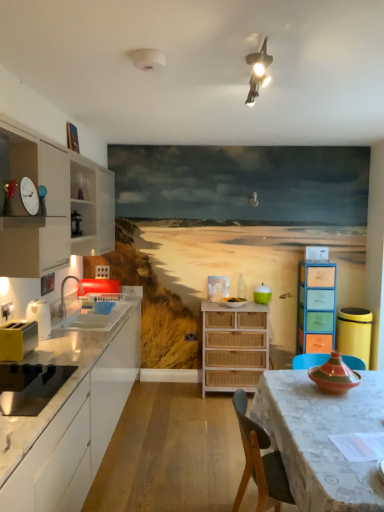
The height and width of the screenshot is (512, 384). What do you see at coordinates (94, 311) in the screenshot? I see `white glossy sink at left` at bounding box center [94, 311].

Image resolution: width=384 pixels, height=512 pixels. I want to click on green matte jar at center, the first appliance in the back-to-front sequence, so click(262, 294).

Consider the image. How much space does black matte toaster at left, the 2th appliance when ordered from bottom to top, occupy horizontally?

black matte toaster at left, the 2th appliance when ordered from bottom to top, is 16.86 inches wide.

From the picture: Measure the distance between white glossy countertop at left, which ranks as the second cabinetry in top-to-bottom order, and camera.

white glossy countertop at left, which ranks as the second cabinetry in top-to-bottom order, and camera are 4.62 feet apart from each other.

Where is `yellow plastic toaster at left`? This screenshot has height=512, width=384. yellow plastic toaster at left is located at coordinates (17, 340).

Is green matte jar at center, the first appliance in the back-to-front sequence, located within woven wood chest of drawers at center, acting as the second chest of drawers starting from the right?

Actually, green matte jar at center, the first appliance in the back-to-front sequence, is outside woven wood chest of drawers at center, acting as the second chest of drawers starting from the right.

In the scene shown: Considering the positions of objects woven wood chest of drawers at center, acting as the second chest of drawers starting from the right, and green matte jar at center, acting as the second appliance starting from the top, in the image provided, who is more to the left, woven wood chest of drawers at center, acting as the second chest of drawers starting from the right, or green matte jar at center, acting as the second appliance starting from the top,?

Positioned to the left is woven wood chest of drawers at center, acting as the second chest of drawers starting from the right.

Where is `the 2nd chest of drawers below the green matte jar at center, which appears as the 6th appliance when ordered from the bottom (from the image's perspective)`? The image size is (384, 512). the 2nd chest of drawers below the green matte jar at center, which appears as the 6th appliance when ordered from the bottom (from the image's perspective) is located at coordinates (233, 346).

Considering the positions of objects white glossy countertop at left, which ranks as the second cabinetry in top-to-bottom order, and black matte toaster at left, placed as the 7th appliance when sorted from back to front, in the image provided, who is more to the right, white glossy countertop at left, which ranks as the second cabinetry in top-to-bottom order, or black matte toaster at left, placed as the 7th appliance when sorted from back to front,?

black matte toaster at left, placed as the 7th appliance when sorted from back to front, is more to the right.

Identify the location of appliance that is the 1st object located behind the white glossy countertop at left, which ranks as the second cabinetry in top-to-bottom order. (30, 387).

From a real-world perspective, which is physically below, white glossy countertop at left, the 1th cabinetry positioned from the bottom, or black matte toaster at left, placed as the 7th appliance when sorted from back to front?

white glossy countertop at left, the 1th cabinetry positioned from the bottom, from a real-world perspective.

Could you measure the distance between white glossy countertop at left, the 1th cabinetry positioned from the bottom, and black matte toaster at left, placed as the 7th appliance when sorted from back to front?

A distance of 14.46 inches exists between white glossy countertop at left, the 1th cabinetry positioned from the bottom, and black matte toaster at left, placed as the 7th appliance when sorted from back to front.

Which object is more forward, white glossy toaster at left, arranged as the 5th appliance when ordered from the bottom, or matte wooden drawer at center, positioned as the sixth appliance in front-to-back order?

white glossy toaster at left, arranged as the 5th appliance when ordered from the bottom, is closer to the camera.

Is white glossy toaster at left, which is the seventh appliance in right-to-left order, not close to matte wooden drawer at center, the 4th appliance viewed from the left?

white glossy toaster at left, which is the seventh appliance in right-to-left order, is far away from matte wooden drawer at center, the 4th appliance viewed from the left.

In terms of width, does white glossy toaster at left, arranged as the first appliance when viewed from the left, look wider or thinner when compared to matte wooden drawer at center, positioned as the 4th appliance in top-to-bottom order?

Clearly, white glossy toaster at left, arranged as the first appliance when viewed from the left, has less width compared to matte wooden drawer at center, positioned as the 4th appliance in top-to-bottom order.

Who is bigger, white glossy toaster at left, arranged as the first appliance when viewed from the left, or matte wooden drawer at center, which appears as the 4th appliance when viewed from the right?

white glossy toaster at left, arranged as the first appliance when viewed from the left.

From a real-world perspective, is white glossy sink at left under metallic silver water filter at upper left, which is the 1th appliance from top to bottom?

Yes, from a real-world perspective, white glossy sink at left is under metallic silver water filter at upper left, which is the 1th appliance from top to bottom.

Can you confirm if white glossy sink at left is positioned to the right of metallic silver water filter at upper left, which is the 4th appliance from back to front?

Yes, white glossy sink at left is to the right of metallic silver water filter at upper left, which is the 4th appliance from back to front.

Is white glossy sink at left inside the boundaries of metallic silver water filter at upper left, placed as the 4th appliance when sorted from front to back, or outside?

white glossy sink at left is outside metallic silver water filter at upper left, placed as the 4th appliance when sorted from front to back.

Which is behind, point (92, 297) or point (78, 233)?

Positioned behind is point (78, 233).

This screenshot has width=384, height=512. Identify the location of cabinetry above the white glossy countertop at left, the 1th cabinetry positioned from the bottom (from the image's perspective). (52, 205).

Does white glossy countertop at left, which ranks as the second cabinetry in top-to-bottom order, turn towards white matte cabinet at left, the 2th cabinetry when ordered from bottom to top?

No, white glossy countertop at left, which ranks as the second cabinetry in top-to-bottom order, is not aimed at white matte cabinet at left, the 2th cabinetry when ordered from bottom to top.

Considering their positions, is white glossy countertop at left, which ranks as the second cabinetry in top-to-bottom order, located in front of or behind white matte cabinet at left, the 2th cabinetry when ordered from bottom to top?

Visually, white glossy countertop at left, which ranks as the second cabinetry in top-to-bottom order, is located in front of white matte cabinet at left, the 2th cabinetry when ordered from bottom to top.

Is multicolored ceramic vase at table, which is the second appliance in front-to-back order, to the left of metallic silver water filter at upper left, the sixth appliance when ordered from right to left, from the viewer's perspective?

Incorrect, multicolored ceramic vase at table, which is the second appliance in front-to-back order, is not on the left side of metallic silver water filter at upper left, the sixth appliance when ordered from right to left.

What's the angular difference between multicolored ceramic vase at table, which appears as the 6th appliance when viewed from the back, and metallic silver water filter at upper left, the sixth appliance when ordered from right to left,'s facing directions?

The angular difference between multicolored ceramic vase at table, which appears as the 6th appliance when viewed from the back, and metallic silver water filter at upper left, the sixth appliance when ordered from right to left, is 177 degrees.

Does multicolored ceramic vase at table, which appears as the 6th appliance when viewed from the back, have a larger size compared to metallic silver water filter at upper left, which is the 1th appliance from top to bottom?

Correct, multicolored ceramic vase at table, which appears as the 6th appliance when viewed from the back, is larger in size than metallic silver water filter at upper left, which is the 1th appliance from top to bottom.

Considering the positions of objects multicolored ceramic vase at table, arranged as the 2th appliance when viewed from the right, and metallic silver water filter at upper left, which is the 4th appliance from back to front, in the image provided, who is behind, multicolored ceramic vase at table, arranged as the 2th appliance when viewed from the right, or metallic silver water filter at upper left, which is the 4th appliance from back to front,?

metallic silver water filter at upper left, which is the 4th appliance from back to front.

From the image's perspective, is yellow plastic toaster at left located above metallic silver water filter at upper left, the sixth appliance when ordered from right to left?

No, from the image's perspective, yellow plastic toaster at left is not above metallic silver water filter at upper left, the sixth appliance when ordered from right to left.

Is yellow plastic toaster at left located outside metallic silver water filter at upper left, the sixth appliance when ordered from right to left?

Yes.

Does yellow plastic toaster at left appear on the left side of metallic silver water filter at upper left, the sixth appliance when ordered from right to left?

Yes.

From the woven wood chest of drawers at center, acting as the second chest of drawers starting from the right, count 1st appliance to the right and point to it. Please provide its 2D coordinates.

[(262, 294)]

From the black matte toaster at left, which ranks as the 1th appliance in front-to-back order, count the 1st cabinetry to the left and point to it. Please provide its 2D coordinates.

[(71, 417)]

When comparing their distances from green matte jar at center, which is the 3th appliance in right-to-left order, does white glossy toaster at left, which is the seventh appliance in right-to-left order, or white glossy countertop at left, which ranks as the second cabinetry in top-to-bottom order, seem further?

white glossy toaster at left, which is the seventh appliance in right-to-left order, is further to green matte jar at center, which is the 3th appliance in right-to-left order.

From the image, which object appears to be farther from matte wooden drawer at center, positioned as the sixth appliance in front-to-back order, yellow plastic trash can at right, the 5th appliance when ordered from front to back, or white glossy sink at left?

The object further to matte wooden drawer at center, positioned as the sixth appliance in front-to-back order, is white glossy sink at left.

From the picture: Looking at the image, which one is located further to patterned fabric table at center, green matte jar at center, which is the seventh appliance in front-to-back order, or metallic silver water filter at upper left, the 7th appliance positioned from the bottom?

metallic silver water filter at upper left, the 7th appliance positioned from the bottom, is positioned further to the anchor patterned fabric table at center.

Considering their positions, is metallic silver water filter at upper left, which ranks as the second appliance in left-to-right order, positioned closer to white glossy sink at left than multicolored plastic chest of drawers at right, arranged as the 2th chest of drawers when viewed from the left?

metallic silver water filter at upper left, which ranks as the second appliance in left-to-right order, lies closer to white glossy sink at left than the other object.

When comparing their distances from multicolored plastic chest of drawers at right, the 1th chest of drawers when ordered from right to left, does white glossy toaster at left, which ranks as the 3th appliance in front-to-back order, or white glossy countertop at left, which ranks as the second cabinetry in top-to-bottom order, seem further?

The object further to multicolored plastic chest of drawers at right, the 1th chest of drawers when ordered from right to left, is white glossy toaster at left, which ranks as the 3th appliance in front-to-back order.

In the scene shown: Which object lies nearer to the anchor point matte wooden drawer at center, which is the second appliance from back to front, yellow plastic toaster at left or white matte cabinet at left, which ranks as the first cabinetry in top-to-bottom order?

Result: Based on the image, white matte cabinet at left, which ranks as the first cabinetry in top-to-bottom order, appears to be nearer to matte wooden drawer at center, which is the second appliance from back to front.

Which object lies further to the anchor point white glossy toaster at left, arranged as the first appliance when viewed from the left, white matte cabinet at left, which ranks as the first cabinetry in top-to-bottom order, or yellow plastic toaster at left?

Based on the image, white matte cabinet at left, which ranks as the first cabinetry in top-to-bottom order, appears to be further to white glossy toaster at left, arranged as the first appliance when viewed from the left.

Estimate the real-world distances between objects in this image. Which object is further from white matte cabinet at left, the 2th cabinetry when ordered from bottom to top, multicolored plastic chest of drawers at right, the 1th chest of drawers when ordered from right to left, or multicolored ceramic vase at table, arranged as the 2th appliance when viewed from the right?

Based on the image, multicolored ceramic vase at table, arranged as the 2th appliance when viewed from the right, appears to be further to white matte cabinet at left, the 2th cabinetry when ordered from bottom to top.

Find the location of `sink between white glossy toaster at left, arranged as the 5th appliance when ordered from the bottom, and yellow plastic trash can at right, positioned as the third appliance in back-to-front order, from left to right`. sink between white glossy toaster at left, arranged as the 5th appliance when ordered from the bottom, and yellow plastic trash can at right, positioned as the third appliance in back-to-front order, from left to right is located at coordinates (94, 311).

The height and width of the screenshot is (512, 384). What are the coordinates of `sink between patterned fabric table at center and multicolored plastic chest of drawers at right, the 1th chest of drawers when ordered from right to left, in the front-back direction` in the screenshot? It's located at (94, 311).

Locate an element on the screen. This screenshot has width=384, height=512. cabinetry between white matte cabinet at left, the 2th cabinetry when ordered from bottom to top, and patterned fabric table at center is located at coordinates (71, 417).

What are the coordinates of `chest of drawers between metallic silver water filter at upper left, which is the 4th appliance from back to front, and green matte jar at center, which is the seventh appliance in front-to-back order` in the screenshot? It's located at (233, 346).